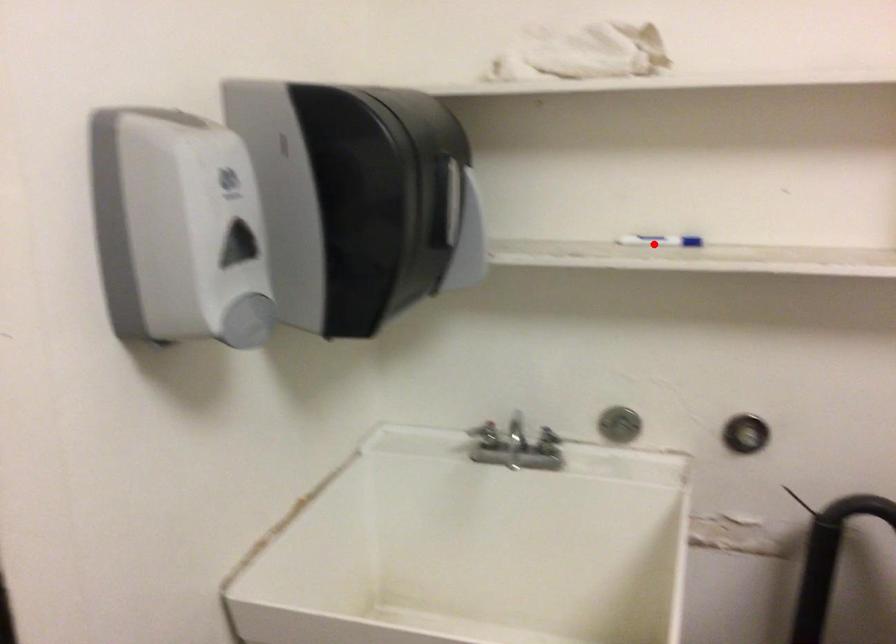
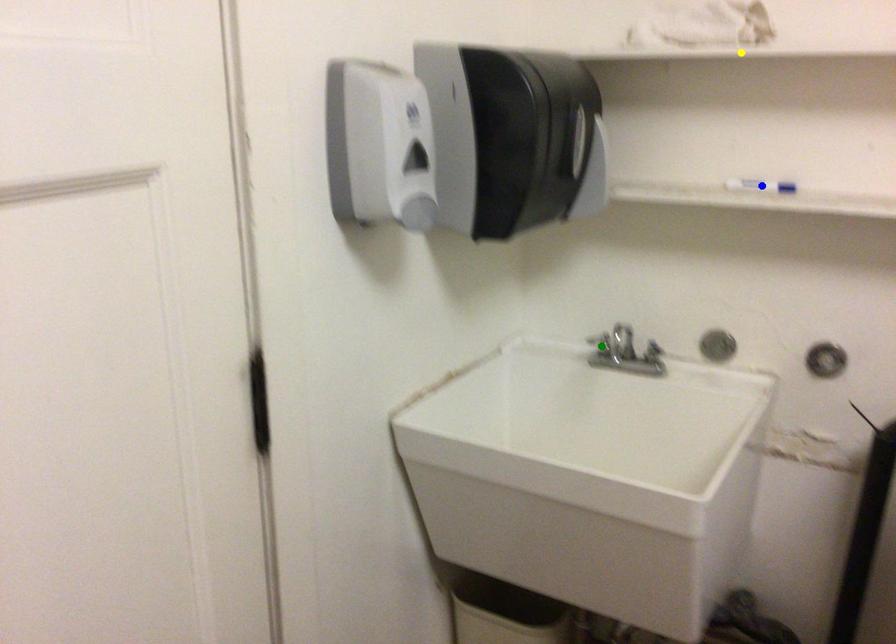
Question: I am providing you with two images of the same scene from different viewpoints. A red point is marked on the first image. You are given multiple points on the second image. Which mark in image 2 goes with the point in image 1?

Choices:
 (A) yellow point
 (B) blue point
 (C) green point

Answer: (B)